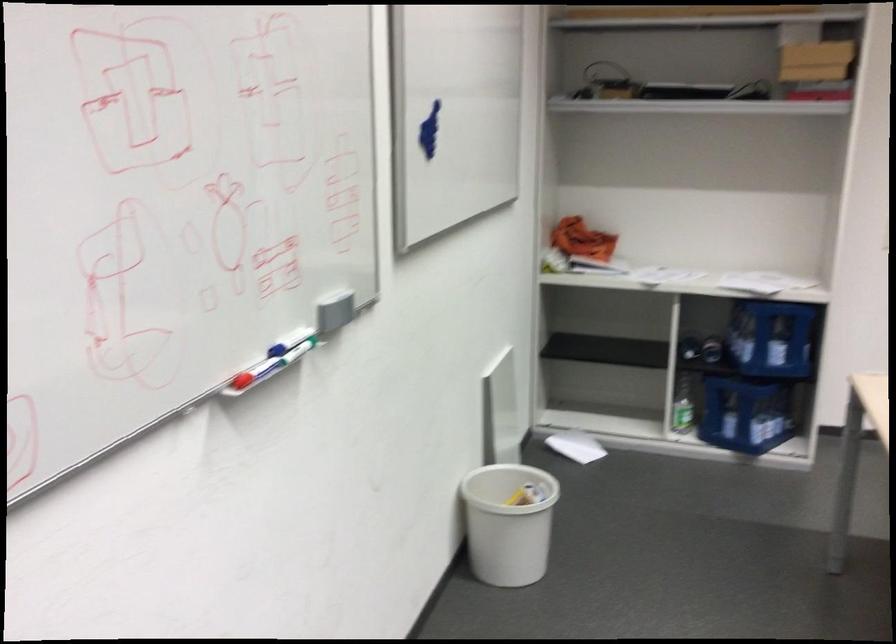
Where is `green whiteboard marker`? green whiteboard marker is located at coordinates click(293, 355).